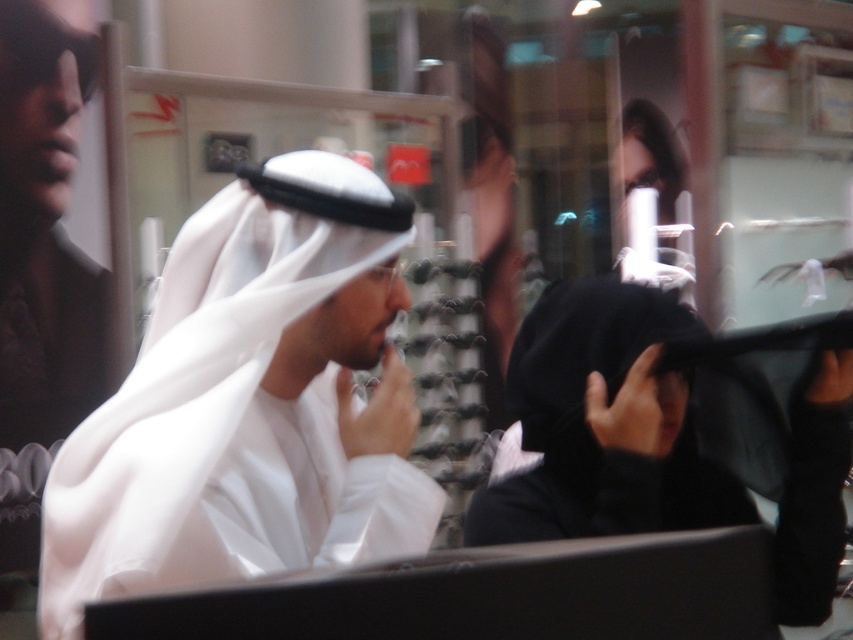
In the scene shown: Can you confirm if white matte headscarf at center is positioned below black matte niqab at center?

Incorrect, white matte headscarf at center is not positioned below black matte niqab at center.

Is white matte headscarf at center above black matte niqab at center?

Yes.

Is point (287, 196) closer to viewer compared to point (525, 506)?

Yes, it is in front of point (525, 506).

Where is `white matte headscarf at center`? white matte headscarf at center is located at coordinates (250, 403).